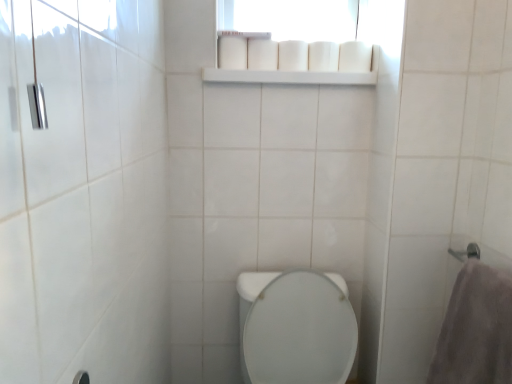
This screenshot has width=512, height=384. Describe the element at coordinates (293, 56) in the screenshot. I see `white matte toilet paper at upper center, which is the 3th toilet paper in right-to-left order` at that location.

Describe the element at coordinates (323, 56) in the screenshot. The height and width of the screenshot is (384, 512). I see `white matte toilet paper at upper center, acting as the 2th toilet paper starting from the right` at that location.

Find the location of a particular element. white matte toilet paper at upper center, marked as the 5th toilet paper in a left-to-right arrangement is located at coordinates (355, 57).

Describe the element at coordinates (476, 329) in the screenshot. I see `gray plush towel at right` at that location.

What is the approximate height of gray plush towel at right?

The height of gray plush towel at right is 16.02 inches.

This screenshot has width=512, height=384. Identify the location of white matte toilet paper at upper center, the 5th toilet paper when ordered from right to left. (232, 53).

Looking at this image, how distant is white matte toilet paper at upper center, marked as the 5th toilet paper in a left-to-right arrangement, from white matte toilet paper at upper center, marked as the fourth toilet paper in a right-to-left arrangement?

27.10 centimeters.

In terms of height, does white matte toilet paper at upper center, marked as the 5th toilet paper in a left-to-right arrangement, look taller or shorter compared to white matte toilet paper at upper center, marked as the fourth toilet paper in a right-to-left arrangement?

In the image, white matte toilet paper at upper center, marked as the 5th toilet paper in a left-to-right arrangement, appears to be taller than white matte toilet paper at upper center, marked as the fourth toilet paper in a right-to-left arrangement.

There is a white matte toilet paper at upper center, the second toilet paper in the left-to-right sequence. At what (x,y) coordinates should I click in order to perform the action: click on the 4th toilet paper below it (from a real-world perspective). Please return your answer as a coordinate pair (x, y). The image size is (512, 384). Looking at the image, I should click on (355, 57).

Is white matte toilet paper at upper center, marked as the 5th toilet paper in a left-to-right arrangement, completely or partially outside of white matte toilet paper at upper center, marked as the fourth toilet paper in a right-to-left arrangement?

That's correct, white matte toilet paper at upper center, marked as the 5th toilet paper in a left-to-right arrangement, is outside of white matte toilet paper at upper center, marked as the fourth toilet paper in a right-to-left arrangement.

Can you tell me how much white matte toilet paper at upper center, the first toilet paper from the left, and white matte shelf at upper center differ in facing direction?

The angular difference between white matte toilet paper at upper center, the first toilet paper from the left, and white matte shelf at upper center is 0.00427 degrees.

Is white matte toilet paper at upper center, the 5th toilet paper when ordered from right to left, taller or shorter than white matte shelf at upper center?

white matte toilet paper at upper center, the 5th toilet paper when ordered from right to left, is taller than white matte shelf at upper center.

Would you say white matte toilet paper at upper center, the 5th toilet paper when ordered from right to left, is to the left or to the right of white matte shelf at upper center in the picture?

From the image, it's evident that white matte toilet paper at upper center, the 5th toilet paper when ordered from right to left, is to the left of white matte shelf at upper center.

Can you confirm if white matte toilet paper at upper center, which is the 3th toilet paper in right-to-left order, is taller than white matte toilet paper at upper center, marked as the fourth toilet paper in a right-to-left arrangement?

No.

Visually, is white matte toilet paper at upper center, which appears as the 3th toilet paper when viewed from the left, positioned to the left or to the right of white matte toilet paper at upper center, the second toilet paper in the left-to-right sequence?

Based on their positions, white matte toilet paper at upper center, which appears as the 3th toilet paper when viewed from the left, is located to the right of white matte toilet paper at upper center, the second toilet paper in the left-to-right sequence.

Is white matte toilet paper at upper center, which appears as the 3th toilet paper when viewed from the left, thinner than white matte toilet paper at upper center, marked as the fourth toilet paper in a right-to-left arrangement?

No, white matte toilet paper at upper center, which appears as the 3th toilet paper when viewed from the left, is not thinner than white matte toilet paper at upper center, marked as the fourth toilet paper in a right-to-left arrangement.

From the image's perspective, which one is positioned higher, white matte toilet paper at upper center, which appears as the 3th toilet paper when viewed from the left, or white matte toilet paper at upper center, marked as the fourth toilet paper in a right-to-left arrangement?

From the image's view, white matte toilet paper at upper center, marked as the fourth toilet paper in a right-to-left arrangement, is above.

Which object is positioned more to the right, white glossy toilet at center or white matte toilet paper at upper center, marked as the fourth toilet paper in a right-to-left arrangement?

From the viewer's perspective, white glossy toilet at center appears more on the right side.

Which object is more forward, white glossy toilet at center or white matte toilet paper at upper center, the second toilet paper in the left-to-right sequence?

white glossy toilet at center is more forward.

Based on the photo, is white glossy toilet at center oriented towards white matte toilet paper at upper center, the second toilet paper in the left-to-right sequence?

No, white glossy toilet at center is not facing towards white matte toilet paper at upper center, the second toilet paper in the left-to-right sequence.

Between white glossy toilet at center and white matte toilet paper at upper center, the second toilet paper in the left-to-right sequence, which one has smaller size?

With smaller size is white matte toilet paper at upper center, the second toilet paper in the left-to-right sequence.

Does white matte shelf at upper center have a greater height compared to white matte toilet paper at upper center, which appears as the 3th toilet paper when viewed from the left?

No, white matte shelf at upper center is not taller than white matte toilet paper at upper center, which appears as the 3th toilet paper when viewed from the left.

Is white matte shelf at upper center smaller than white matte toilet paper at upper center, which appears as the 3th toilet paper when viewed from the left?

Incorrect, white matte shelf at upper center is not smaller in size than white matte toilet paper at upper center, which appears as the 3th toilet paper when viewed from the left.

Is white matte shelf at upper center positioned with its back to white matte toilet paper at upper center, which is the 3th toilet paper in right-to-left order?

white matte shelf at upper center is not turned away from white matte toilet paper at upper center, which is the 3th toilet paper in right-to-left order.

Is gray plush towel at right at the back of white glossy toilet at center?

No, white glossy toilet at center is not facing away from gray plush towel at right.

From the image's perspective, which one is positioned higher, white glossy toilet at center or gray plush towel at right?

gray plush towel at right appears higher in the image.

You are a GUI agent. You are given a task and a screenshot of the screen. Output one action in this format:
    pyautogui.click(x=<x>, y=<y>)
    Task: Click on the bath towel above the white glossy toilet at center (from a real-world perspective)
    
    Given the screenshot: What is the action you would take?
    pyautogui.click(x=476, y=329)

Between white glossy toilet at center and gray plush towel at right, which one has larger size?

With larger size is white glossy toilet at center.

Can you confirm if white matte toilet paper at upper center, the 5th toilet paper when ordered from right to left, is taller than white matte toilet paper at upper center, which appears as the 3th toilet paper when viewed from the left?

Indeed, white matte toilet paper at upper center, the 5th toilet paper when ordered from right to left, has a greater height compared to white matte toilet paper at upper center, which appears as the 3th toilet paper when viewed from the left.

From the image's perspective, is white matte toilet paper at upper center, the first toilet paper from the left, located beneath white matte toilet paper at upper center, which appears as the 3th toilet paper when viewed from the left?

No, from the image's perspective, white matte toilet paper at upper center, the first toilet paper from the left, is not beneath white matte toilet paper at upper center, which appears as the 3th toilet paper when viewed from the left.

Which is nearer, (246, 50) or (293, 64)?

Point (246, 50).

Where is `toilet paper that is the 4th object above the white matte toilet paper at upper center, the first toilet paper viewed from the right (from a real-world perspective)`? toilet paper that is the 4th object above the white matte toilet paper at upper center, the first toilet paper viewed from the right (from a real-world perspective) is located at coordinates (262, 55).

Locate an element on the screen. This screenshot has width=512, height=384. balustrade directly beneath the white matte toilet paper at upper center, the 5th toilet paper when ordered from right to left (from a real-world perspective) is located at coordinates (289, 77).

Considering their positions, is white matte toilet paper at upper center, which is counted as the fourth toilet paper, starting from the left, positioned further to white glossy toilet at center than white matte shelf at upper center?

white matte toilet paper at upper center, which is counted as the fourth toilet paper, starting from the left.

From the image, which object appears to be farther from white matte toilet paper at upper center, the first toilet paper from the left, white matte toilet paper at upper center, marked as the 5th toilet paper in a left-to-right arrangement, or white matte toilet paper at upper center, marked as the fourth toilet paper in a right-to-left arrangement?

white matte toilet paper at upper center, marked as the 5th toilet paper in a left-to-right arrangement, lies further to white matte toilet paper at upper center, the first toilet paper from the left, than the other object.

Looking at the image, which one is located closer to white matte toilet paper at upper center, marked as the 5th toilet paper in a left-to-right arrangement, white matte toilet paper at upper center, acting as the 2th toilet paper starting from the right, or white glossy toilet at center?

Based on the image, white matte toilet paper at upper center, acting as the 2th toilet paper starting from the right, appears to be nearer to white matte toilet paper at upper center, marked as the 5th toilet paper in a left-to-right arrangement.

Considering their positions, is white matte toilet paper at upper center, which is the 3th toilet paper in right-to-left order, positioned further to white matte toilet paper at upper center, the second toilet paper in the left-to-right sequence, than gray plush towel at right?

gray plush towel at right lies further to white matte toilet paper at upper center, the second toilet paper in the left-to-right sequence, than the other object.

When comparing their distances from gray plush towel at right, does white matte toilet paper at upper center, acting as the 2th toilet paper starting from the right, or white matte toilet paper at upper center, the first toilet paper from the left, seem further?

Based on the image, white matte toilet paper at upper center, the first toilet paper from the left, appears to be further to gray plush towel at right.

Considering their positions, is white matte toilet paper at upper center, the 5th toilet paper when ordered from right to left, positioned closer to white matte toilet paper at upper center, marked as the 5th toilet paper in a left-to-right arrangement, than white matte toilet paper at upper center, the second toilet paper in the left-to-right sequence?

The object closer to white matte toilet paper at upper center, marked as the 5th toilet paper in a left-to-right arrangement, is white matte toilet paper at upper center, the second toilet paper in the left-to-right sequence.

In the scene shown: Estimate the real-world distances between objects in this image. Which object is further from white matte toilet paper at upper center, marked as the 5th toilet paper in a left-to-right arrangement, gray plush towel at right or white matte toilet paper at upper center, which appears as the 3th toilet paper when viewed from the left?

gray plush towel at right is further to white matte toilet paper at upper center, marked as the 5th toilet paper in a left-to-right arrangement.

From the image, which object appears to be farther from white matte toilet paper at upper center, which appears as the 3th toilet paper when viewed from the left, white matte toilet paper at upper center, the second toilet paper in the left-to-right sequence, or white matte toilet paper at upper center, marked as the 5th toilet paper in a left-to-right arrangement?

white matte toilet paper at upper center, marked as the 5th toilet paper in a left-to-right arrangement, is further to white matte toilet paper at upper center, which appears as the 3th toilet paper when viewed from the left.

Find the location of `balustrade between white matte toilet paper at upper center, the first toilet paper from the left, and gray plush towel at right, in the vertical direction`. balustrade between white matte toilet paper at upper center, the first toilet paper from the left, and gray plush towel at right, in the vertical direction is located at coordinates (289, 77).

Where is `bath towel between white matte toilet paper at upper center, which is the 3th toilet paper in right-to-left order, and white glossy toilet at center from top to bottom`? This screenshot has height=384, width=512. bath towel between white matte toilet paper at upper center, which is the 3th toilet paper in right-to-left order, and white glossy toilet at center from top to bottom is located at coordinates (476, 329).

Find the location of `toilet paper situated between white matte shelf at upper center and white matte toilet paper at upper center, acting as the 2th toilet paper starting from the right, from left to right`. toilet paper situated between white matte shelf at upper center and white matte toilet paper at upper center, acting as the 2th toilet paper starting from the right, from left to right is located at coordinates (293, 56).

In order to click on balustrade between white matte toilet paper at upper center, marked as the 5th toilet paper in a left-to-right arrangement, and white glossy toilet at center from top to bottom in this screenshot , I will do `click(289, 77)`.